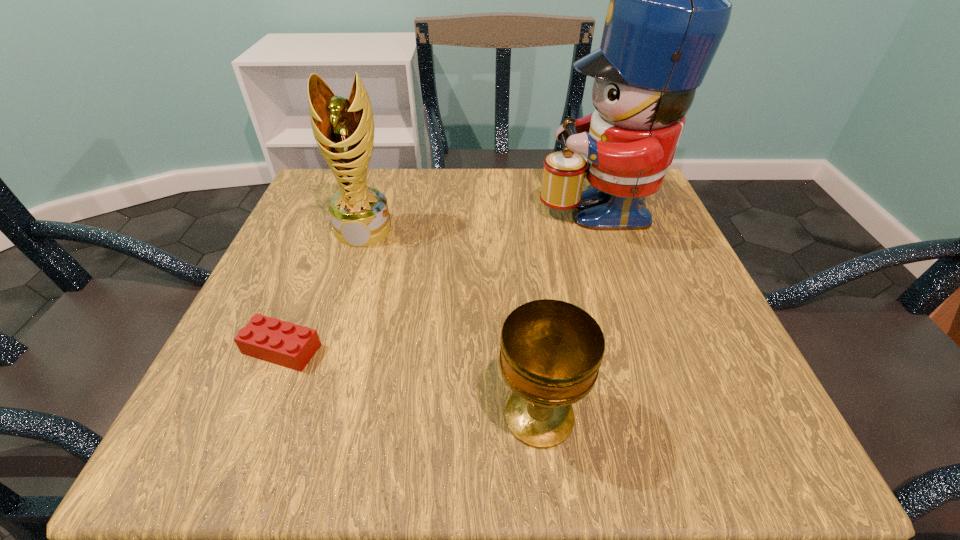
In the image, there is a desktop. Identify the location of vacant space at the far edge. (419, 200).

In the image, there is a desktop. Identify the location of free region at the near edge. This screenshot has width=960, height=540. (391, 436).

This screenshot has width=960, height=540. Find the location of `free space at the left edge of the desktop`. free space at the left edge of the desktop is located at coordinates click(307, 372).

Image resolution: width=960 pixels, height=540 pixels. In order to click on free space at the right edge of the desktop in this screenshot , I will do (643, 256).

Image resolution: width=960 pixels, height=540 pixels. What are the coordinates of `free space at the far left corner of the desktop` in the screenshot? It's located at (386, 171).

At what (x,y) coordinates should I click in order to perform the action: click on vacant space at the near right corner. Please return your answer as a coordinate pair (x, y). This screenshot has width=960, height=540. Looking at the image, I should click on (733, 460).

Where is `free space between the Lego and the nearest object`? The height and width of the screenshot is (540, 960). free space between the Lego and the nearest object is located at coordinates (411, 383).

Identify the location of free space between the shortest object and the second shortest object. (411, 383).

Locate an element on the screen. The width and height of the screenshot is (960, 540). vacant point located between the nearest object and the award is located at coordinates (451, 323).

Where is `free space between the shortest object and the tallest object`? The width and height of the screenshot is (960, 540). free space between the shortest object and the tallest object is located at coordinates (440, 277).